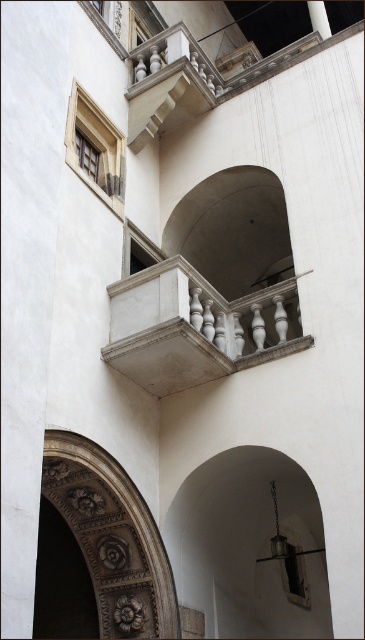
Based on the photo, does white marble balcony at center appear under carved stone archway at lower left?

No, white marble balcony at center is not below carved stone archway at lower left.

Measure the distance between point (x=289, y=348) and camera.

They are 39.09 meters apart.

Between point (140, 289) and point (112, 499), which one is positioned behind?

Point (140, 289)

This screenshot has height=640, width=365. Identify the location of white marble balcony at center. (196, 326).